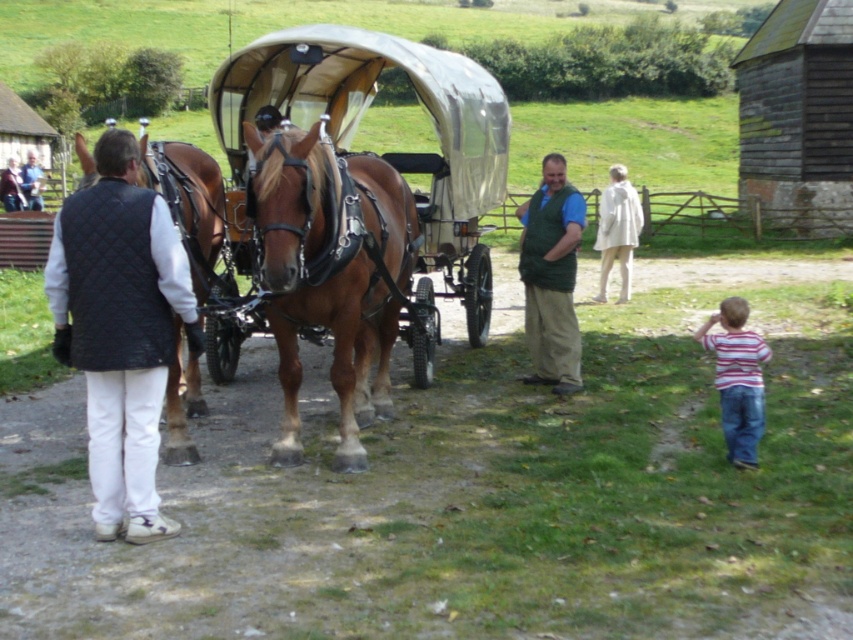
Is brown glossy horse at left wider than striped shirt at lower right?

Indeed, brown glossy horse at left has a greater width compared to striped shirt at lower right.

Is point (187, 451) positioned in front of point (728, 307)?

No, (187, 451) is further to viewer.

You are a GUI agent. You are given a task and a screenshot of the screen. Output one action in this format:
    pyautogui.click(x=<x>, y=<y>)
    Task: Click on the brown glossy horse at left
    
    Given the screenshot: What is the action you would take?
    pyautogui.click(x=189, y=204)

This screenshot has height=640, width=853. Find the location of `brown glossy horse at left`. brown glossy horse at left is located at coordinates (189, 204).

Can you confirm if brown glossy horse at left is positioned below green quilted vest at center?

Actually, brown glossy horse at left is above green quilted vest at center.

Locate an element on the screen. The image size is (853, 640). brown glossy horse at left is located at coordinates (189, 204).

Is point (508, 138) positioned before point (364, 333)?

No, (508, 138) is behind (364, 333).

Does shiny brown leather horse cart at center appear under brown leather horse at center?

No, shiny brown leather horse cart at center is not below brown leather horse at center.

Who is more distant from viewer, (421, 278) or (407, 257)?

The point (421, 278) is more distant.

This screenshot has height=640, width=853. I want to click on shiny brown leather horse cart at center, so click(x=392, y=150).